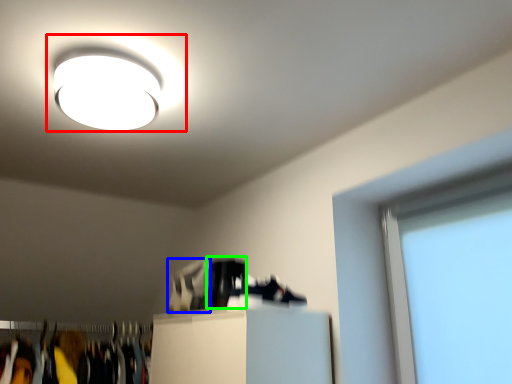
Question: Which object is the closest to the lamp (highlighted by a red box)? Choose among these: shoe (highlighted by a blue box) or shoe (highlighted by a green box).

Choices:
 (A) shoe
 (B) shoe

Answer: (B)